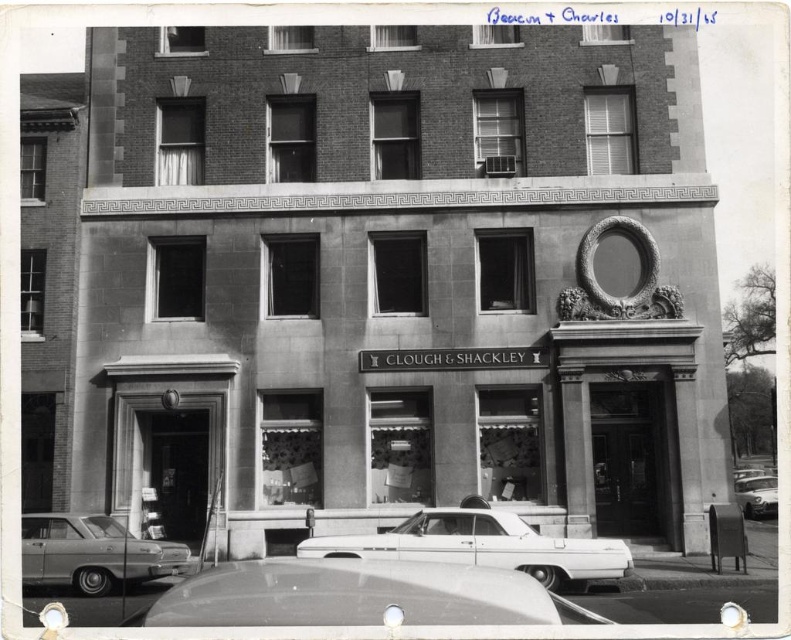
Does point (532, 541) come closer to viewer compared to point (67, 566)?

Yes, point (532, 541) is in front of point (67, 566).

Locate an element on the screen. shiny white sedan at center is located at coordinates (483, 545).

Is shiny white sedan at center wider than shiny silver car at lower right?

No, shiny white sedan at center is not wider than shiny silver car at lower right.

Which is behind, point (592, 556) or point (771, 476)?

The point (771, 476) is more distant.

Does point (542, 577) come closer to viewer compared to point (740, 477)?

Yes, it is in front of point (740, 477).

Locate an element on the screen. This screenshot has height=640, width=791. shiny white sedan at center is located at coordinates (483, 545).

Which of these two, metallic gray sedan at lower left or shiny silver car at lower right, stands shorter?

Standing shorter between the two is metallic gray sedan at lower left.

Which of these two, metallic gray sedan at lower left or shiny silver car at lower right, stands taller?

shiny silver car at lower right

Between point (122, 545) and point (759, 493), which one is positioned behind?

Point (759, 493)

You are a GUI agent. You are given a task and a screenshot of the screen. Output one action in this format:
    pyautogui.click(x=<x>, y=<y>)
    Task: Click on the metallic gray sedan at lower left
    Image resolution: width=791 pixels, height=640 pixels.
    Given the screenshot: What is the action you would take?
    pyautogui.click(x=93, y=554)